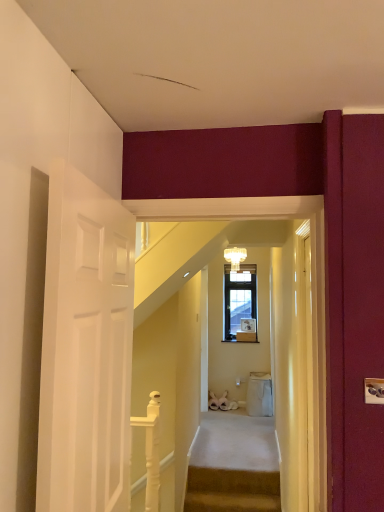
At what (x,y) coordinates should I click in order to perform the action: click on vacant space underneath crystal glass chandelier at upper center (from a real-world perspective). Please return your answer as a coordinate pair (x, y). Looking at the image, I should click on (235, 436).